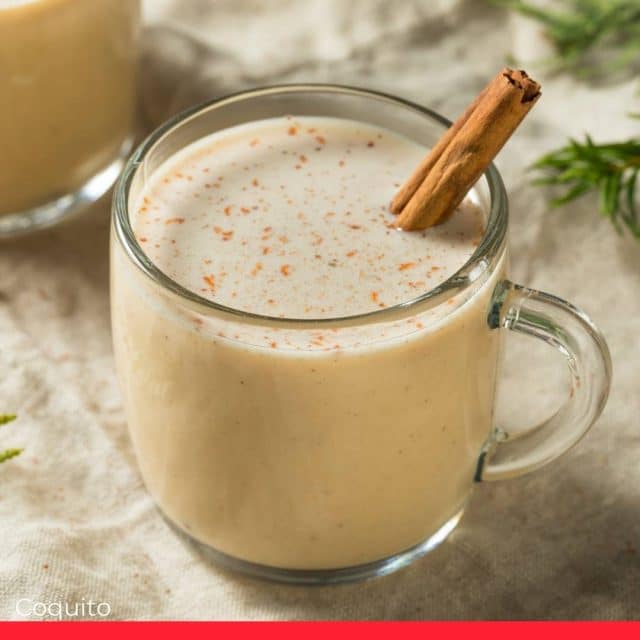
Identify the location of cloth tablecloth. (68, 409), (528, 596), (612, 296).